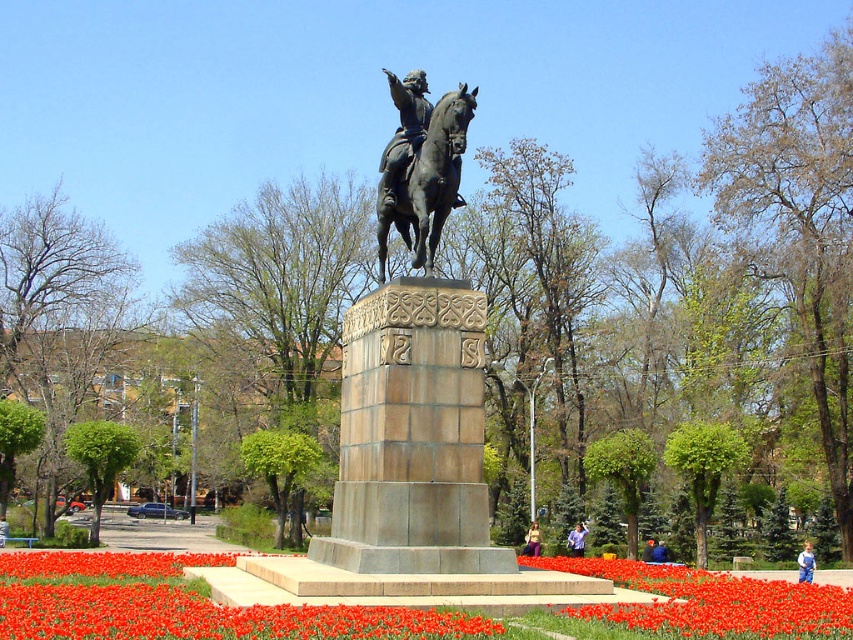
You are a park visitor who wants to take a photo of the bronze statue at center and the blue fabric jacket at center from a distance where both can be captured in the frame. Given that your camera has a maximum focal length that allows capturing objects up to 60 meters apart in the same frame, can you take the photo without moving closer?

The distance between the bronze statue at center and the blue fabric jacket at center is 59.51 meters. Since this distance is under the camera maximum focal length of 60 meters, you can take the photo without moving closer.

You are an artist planning to sketch the scene from the park. You notice the bronze statue at center and the blue fabric jacket at center. Which object should you draw first if you want to capture the most prominent elements first?

The bronze statue at center has a larger size compared to the blue fabric jacket at center, so you should draw the bronze statue at center first to capture the most prominent elements first.